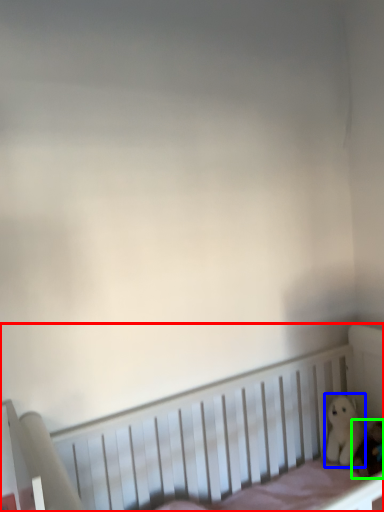
Question: Considering the real-world distances, which object is farthest from infant bed (highlighted by a red box)? toy (highlighted by a blue box) or toy (highlighted by a green box)?

Choices:
 (A) toy
 (B) toy

Answer: (B)